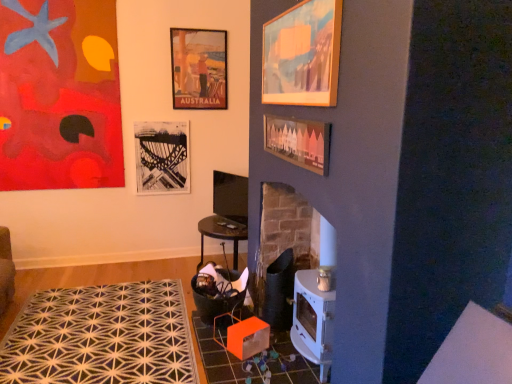
Question: Which direction should I rotate to face matte paper poster at upper center, marked as the third picture frame in a left-to-right arrangement, — up or down?

Choices:
 (A) down
 (B) up

Answer: (B)

Question: Is wooden picture frame at center, the fourth picture frame viewed from the back, not near matte paper poster at upper center, which ranks as the 2th picture frame in back-to-front order?

Choices:
 (A) no
 (B) yes

Answer: (B)

Question: From a real-world perspective, is wooden picture frame at center, the 2th picture frame viewed from the right, positioned under matte paper poster at upper center, which is counted as the 4th picture frame, starting from the front, based on gravity?

Choices:
 (A) no
 (B) yes

Answer: (B)

Question: Can you see wooden picture frame at center, acting as the 4th picture frame starting from the left, touching matte paper poster at upper center, which is counted as the 4th picture frame, starting from the front?

Choices:
 (A) no
 (B) yes

Answer: (A)

Question: Is the depth of wooden picture frame at center, positioned as the second picture frame in front-to-back order, greater than that of matte paper poster at upper center, which is counted as the 4th picture frame, starting from the front?

Choices:
 (A) no
 (B) yes

Answer: (A)

Question: Is wooden picture frame at center, acting as the 4th picture frame starting from the left, smaller than matte paper poster at upper center, marked as the third picture frame in a left-to-right arrangement?

Choices:
 (A) no
 (B) yes

Answer: (B)

Question: Could matte paper poster at upper center, acting as the third picture frame starting from the right, be considered to be inside wooden picture frame at center, the 2th picture frame viewed from the right?

Choices:
 (A) no
 (B) yes

Answer: (A)

Question: Can you confirm if white geometric rug at lower left is positioned to the left of wooden picture frame at upper center, positioned as the fifth picture frame in left-to-right order?

Choices:
 (A) no
 (B) yes

Answer: (B)

Question: Does white geometric rug at lower left have a larger size compared to wooden picture frame at upper center, positioned as the fifth picture frame in left-to-right order?

Choices:
 (A) no
 (B) yes

Answer: (B)

Question: From a real-world perspective, does white geometric rug at lower left sit lower than wooden picture frame at upper center, positioned as the fifth picture frame in left-to-right order?

Choices:
 (A) yes
 (B) no

Answer: (A)

Question: From a real-world perspective, is white geometric rug at lower left positioned over wooden picture frame at upper center, positioned as the 1th picture frame in right-to-left order, based on gravity?

Choices:
 (A) yes
 (B) no

Answer: (B)

Question: Is white geometric rug at lower left in contact with wooden picture frame at upper center, positioned as the fifth picture frame in back-to-front order?

Choices:
 (A) yes
 (B) no

Answer: (B)

Question: Does white geometric rug at lower left appear on the right side of wooden picture frame at upper center, positioned as the fifth picture frame in back-to-front order?

Choices:
 (A) no
 (B) yes

Answer: (A)

Question: Would you consider abstract painting at upper left, the third picture frame positioned from the front, to be distant from wooden picture frame at center, the 2th picture frame viewed from the right?

Choices:
 (A) no
 (B) yes

Answer: (B)